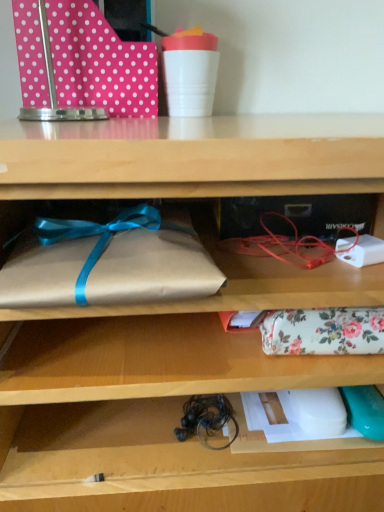
Question: Can you confirm if pink polka dot wrapping paper at upper left is smaller than black rubber twine at lower center?

Choices:
 (A) yes
 (B) no

Answer: (B)

Question: From a real-world perspective, is pink polka dot wrapping paper at upper left physically above black rubber twine at lower center?

Choices:
 (A) yes
 (B) no

Answer: (A)

Question: Considering the relative sizes of pink polka dot wrapping paper at upper left and black rubber twine at lower center in the image provided, is pink polka dot wrapping paper at upper left wider than black rubber twine at lower center?

Choices:
 (A) yes
 (B) no

Answer: (A)

Question: Is pink polka dot wrapping paper at upper left located outside black rubber twine at lower center?

Choices:
 (A) no
 (B) yes

Answer: (B)

Question: Is pink polka dot wrapping paper at upper left bigger than black rubber twine at lower center?

Choices:
 (A) no
 (B) yes

Answer: (B)

Question: Is pink polka dot wrapping paper at upper left in contact with black rubber twine at lower center?

Choices:
 (A) no
 (B) yes

Answer: (A)

Question: Is black rubber twine at lower center further to the viewer compared to floral fabric pouch at center, which is the 2th wrap from front to back?

Choices:
 (A) yes
 (B) no

Answer: (A)

Question: Is black rubber twine at lower center smaller than floral fabric pouch at center, which is the first wrap in back-to-front order?

Choices:
 (A) no
 (B) yes

Answer: (B)

Question: Does black rubber twine at lower center have a greater height compared to floral fabric pouch at center, which is the first wrap in back-to-front order?

Choices:
 (A) no
 (B) yes

Answer: (A)

Question: Is black rubber twine at lower center closer to camera compared to floral fabric pouch at center, marked as the first wrap in a bottom-to-top arrangement?

Choices:
 (A) yes
 (B) no

Answer: (B)

Question: From the image's perspective, would you say black rubber twine at lower center is shown under floral fabric pouch at center, which is the 2th wrap from front to back?

Choices:
 (A) yes
 (B) no

Answer: (A)

Question: Is black rubber twine at lower center turned away from floral fabric pouch at center, the first wrap in the right-to-left sequence?

Choices:
 (A) yes
 (B) no

Answer: (B)

Question: Is brown paper wrapped at left, acting as the 1th wrap starting from the top, beside black rubber twine at lower center?

Choices:
 (A) no
 (B) yes

Answer: (A)